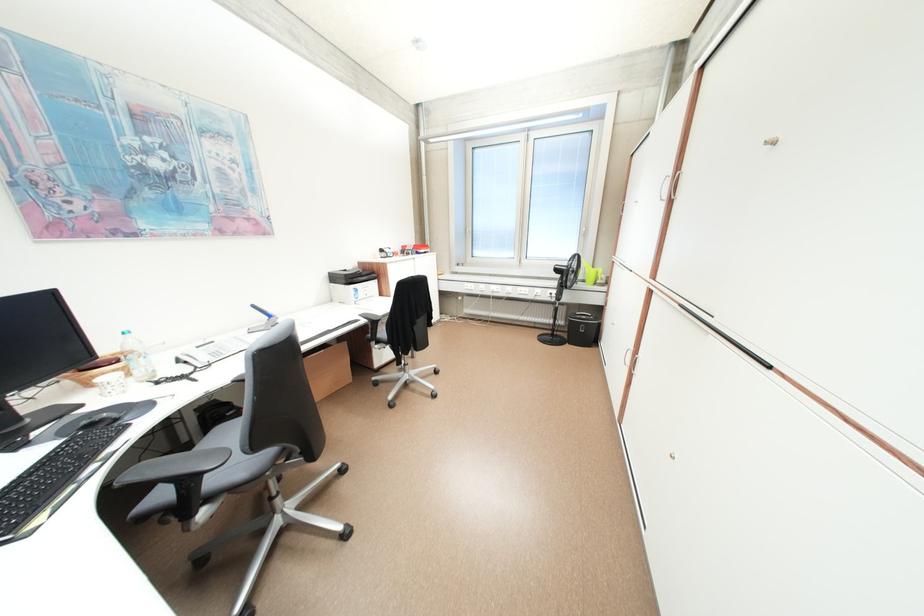
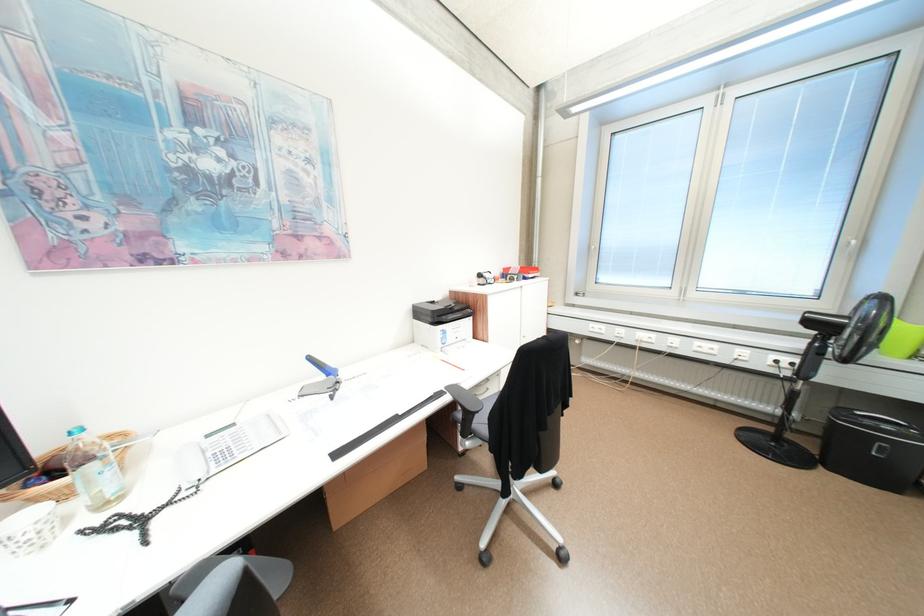
In the second image, find the point that corresponds to point 141,367 in the first image.

(91, 487)